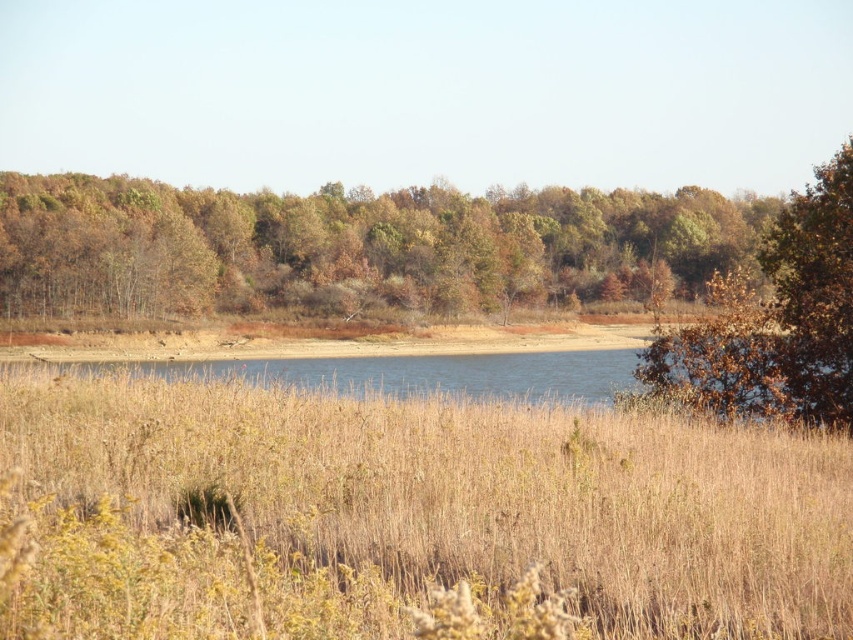
You are standing at the edge of the water and want to walk towards the forest. You see the dry grass at center and the brown leafy bush at right. Which object is closer to you?

The dry grass at center is closer to you because it is located below the brown leafy bush at right, meaning it is positioned in front of it from your perspective.